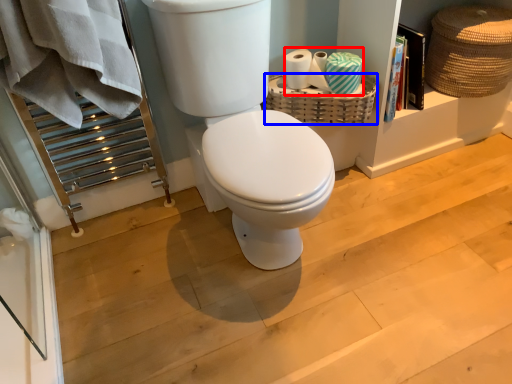
Question: Which object appears closest to the camera in this image, toilet paper (highlighted by a red box) or basket (highlighted by a blue box)?

Choices:
 (A) toilet paper
 (B) basket

Answer: (A)